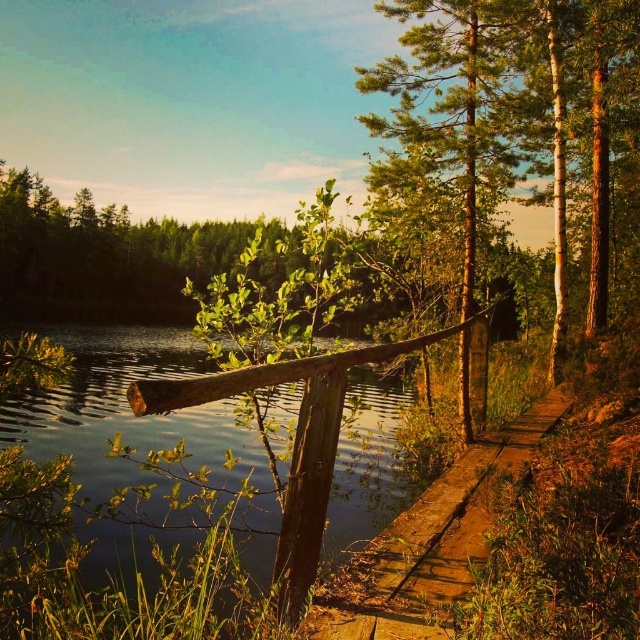
You are a maintenance worker tasked with repairing the wooden plank path at center. You need to place a safety barrier between the path and the transparent water at lower left. What is the minimum width of the barrier required to cover the gap between them?

The distance between the transparent water at lower left and the wooden plank path at center is 1.13 meters. Therefore, the safety barrier must be at least 1.13 meters wide to cover the gap between them.

You are planning to cross the wooden plank path at center to reach the other side of the transparent water at lower left. Considering their sizes, which one do you think covers more area in the image?

The transparent water at lower left has a larger size compared to the wooden plank path at center, so the transparent water at lower left covers more area in the image.